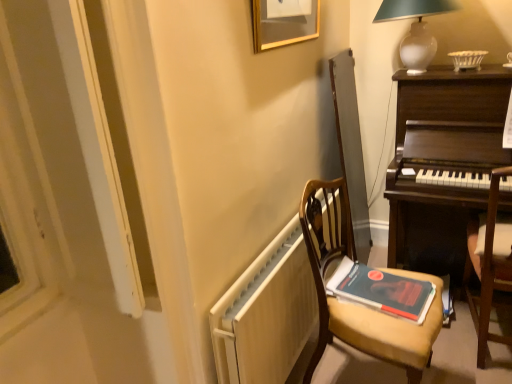
Question: Should I look upward or downward to see dark wood piano at right?

Choices:
 (A) up
 (B) down

Answer: (A)

Question: Is white matte radiator at lower center at the back of wooden chair at right, which is the first chair from right to left?

Choices:
 (A) no
 (B) yes

Answer: (A)

Question: Can you confirm if wooden chair at right, which is the 2th chair in left-to-right order, is taller than white matte radiator at lower center?

Choices:
 (A) yes
 (B) no

Answer: (A)

Question: Is wooden chair at right, which is the first chair from right to left, wider than white matte radiator at lower center?

Choices:
 (A) yes
 (B) no

Answer: (A)

Question: Is wooden chair at right, which is the 2th chair in left-to-right order, not inside white matte radiator at lower center?

Choices:
 (A) no
 (B) yes

Answer: (B)

Question: Is wooden chair at right, which is the 2th chair in left-to-right order, further to camera compared to white matte radiator at lower center?

Choices:
 (A) no
 (B) yes

Answer: (B)

Question: Does wooden chair at right, which is the 2th chair in left-to-right order, have a lesser height compared to white matte radiator at lower center?

Choices:
 (A) no
 (B) yes

Answer: (A)

Question: From a real-world perspective, is wooden chair at center, the second chair viewed from the right, below hardcover book at center?

Choices:
 (A) no
 (B) yes

Answer: (B)

Question: Considering the relative positions of wooden chair at center, the second chair viewed from the right, and hardcover book at center in the image provided, is wooden chair at center, the second chair viewed from the right, behind hardcover book at center?

Choices:
 (A) yes
 (B) no

Answer: (B)

Question: Does wooden chair at center, the second chair viewed from the right, turn towards hardcover book at center?

Choices:
 (A) yes
 (B) no

Answer: (A)

Question: Can we say wooden chair at center, the second chair viewed from the right, lies outside hardcover book at center?

Choices:
 (A) no
 (B) yes

Answer: (B)

Question: From a real-world perspective, is wooden chair at center, the second chair viewed from the right, over hardcover book at center?

Choices:
 (A) no
 (B) yes

Answer: (A)

Question: Is wooden chair at center, the second chair viewed from the right, at the left side of hardcover book at center?

Choices:
 (A) no
 (B) yes

Answer: (B)

Question: Can you confirm if gold-framed picture at upper center is bigger than white glass table lamp at upper right?

Choices:
 (A) yes
 (B) no

Answer: (B)